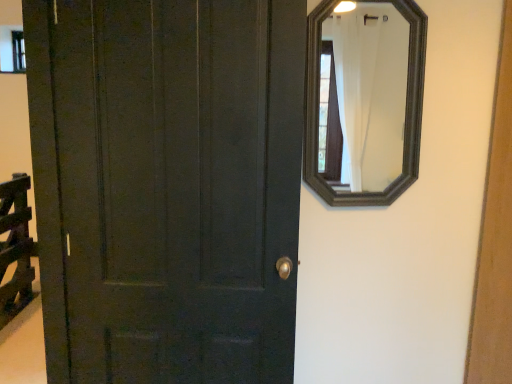
Measure the distance between point (41, 202) and camera.

They are 4.71 feet apart.

Describe the element at coordinates (167, 186) in the screenshot. I see `matte dark green door at left` at that location.

The image size is (512, 384). In order to click on black wooden mirror at upper right in this screenshot , I will do `click(370, 92)`.

Which of these two, black wooden mirror at upper right or matte dark green door at left, is thinner?

black wooden mirror at upper right.

Is point (393, 81) positioned behind point (290, 279)?

Yes, point (393, 81) is behind point (290, 279).

Is black wooden mirror at upper right to the left or to the right of matte dark green door at left in the image?

From the image, it's evident that black wooden mirror at upper right is to the right of matte dark green door at left.

Considering their positions, is black wooden mirror at upper right located in front of or behind matte dark green door at left?

black wooden mirror at upper right is positioned farther from the viewer than matte dark green door at left.

Which object is more forward, black wooden mirror at upper right or transparent glass window at upper left?

black wooden mirror at upper right.

Is there a large distance between black wooden mirror at upper right and transparent glass window at upper left?

Yes.

Image resolution: width=512 pixels, height=384 pixels. Identify the location of window behind the black wooden mirror at upper right. (12, 49).

Considering the positions of point (261, 239) and point (23, 42), is point (261, 239) closer or farther from the camera than point (23, 42)?

Clearly, point (261, 239) is closer to the camera than point (23, 42).

Looking at this image, considering the relative sizes of matte dark green door at left and transparent glass window at upper left in the image provided, is matte dark green door at left bigger than transparent glass window at upper left?

Yes, matte dark green door at left is bigger than transparent glass window at upper left.

Is matte dark green door at left taller or shorter than transparent glass window at upper left?

In the image, matte dark green door at left appears to be taller than transparent glass window at upper left.

Between transparent glass window at upper left and black wooden mirror at upper right, which one has less height?

Standing shorter between the two is transparent glass window at upper left.

From the image's perspective, relative to black wooden mirror at upper right, is transparent glass window at upper left above or below?

Based on their image positions, transparent glass window at upper left is located above black wooden mirror at upper right.

Is transparent glass window at upper left surrounding black wooden mirror at upper right?

That's incorrect, black wooden mirror at upper right is not inside transparent glass window at upper left.

Is transparent glass window at upper left wider or thinner than black wooden mirror at upper right?

In the image, transparent glass window at upper left appears to be more narrow than black wooden mirror at upper right.

Which object is more forward, matte dark green door at left or black wooden mirror at upper right?

matte dark green door at left is in front.

Are matte dark green door at left and black wooden mirror at upper right beside each other?

No.

Is point (161, 263) positioned in front of point (376, 20)?

Yes, point (161, 263) is closer to viewer.

Measure the distance from matte dark green door at left to black wooden mirror at upper right.

The distance of matte dark green door at left from black wooden mirror at upper right is 11.32 feet.

Is the surface of transparent glass window at upper left in direct contact with matte dark green door at left?

No, transparent glass window at upper left is not with matte dark green door at left.

Considering the relative positions of transparent glass window at upper left and matte dark green door at left in the image provided, is transparent glass window at upper left to the left of matte dark green door at left from the viewer's perspective?

Indeed, transparent glass window at upper left is positioned on the left side of matte dark green door at left.

Which object is more forward, transparent glass window at upper left or matte dark green door at left?

matte dark green door at left is more forward.

Image resolution: width=512 pixels, height=384 pixels. In order to click on mirror that appears behind the matte dark green door at left in this screenshot , I will do `click(370, 92)`.

In the image, there is a transparent glass window at upper left. Where is `mirror below it (from the image's perspective)`? mirror below it (from the image's perspective) is located at coordinates (370, 92).

When comparing their distances from black wooden mirror at upper right, does transparent glass window at upper left or matte dark green door at left seem closer?

Among the two, transparent glass window at upper left is located nearer to black wooden mirror at upper right.

Consider the image. From the image, which object appears to be nearer to transparent glass window at upper left, matte dark green door at left or black wooden mirror at upper right?

matte dark green door at left.

Which object lies nearer to the anchor point matte dark green door at left, transparent glass window at upper left or black wooden mirror at upper right?

The object closer to matte dark green door at left is transparent glass window at upper left.

Considering their positions, is black wooden mirror at upper right positioned closer to matte dark green door at left than transparent glass window at upper left?

transparent glass window at upper left lies closer to matte dark green door at left than the other object.

Considering their positions, is black wooden mirror at upper right positioned further to transparent glass window at upper left than matte dark green door at left?

The object further to transparent glass window at upper left is black wooden mirror at upper right.

When comparing their distances from black wooden mirror at upper right, does matte dark green door at left or transparent glass window at upper left seem further?

Based on the image, matte dark green door at left appears to be further to black wooden mirror at upper right.

Image resolution: width=512 pixels, height=384 pixels. Identify the location of mirror between matte dark green door at left and transparent glass window at upper left in the front-back direction. (370, 92).